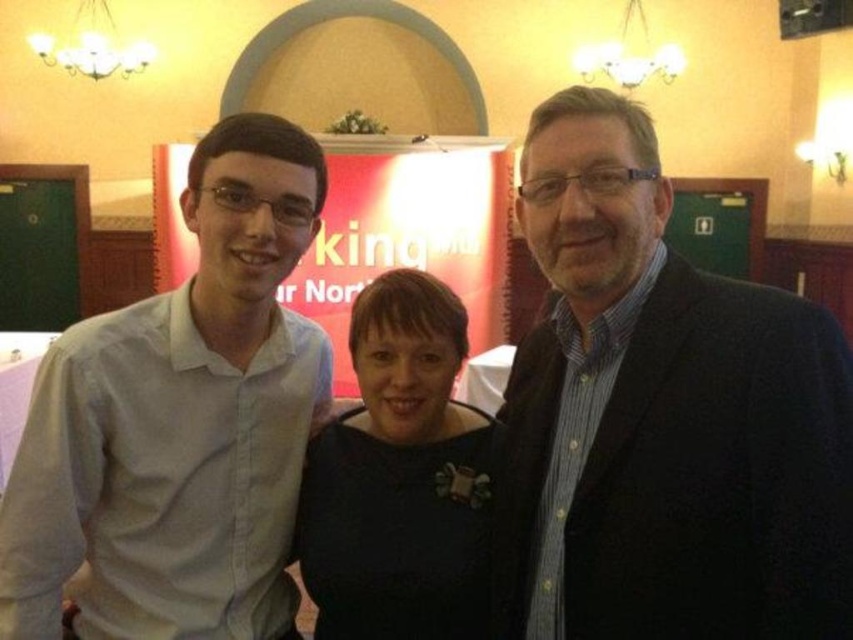
Question: Estimate the real-world distances between objects in this image. Which object is farther from the white shirt at center?

Choices:
 (A) black matte dress at center
 (B) dark blue suit at center

Answer: (B)

Question: Is white shirt at center below black matte dress at center?

Choices:
 (A) yes
 (B) no

Answer: (B)

Question: Considering the relative positions of dark blue suit at center and white shirt at center in the image provided, where is dark blue suit at center located with respect to white shirt at center?

Choices:
 (A) below
 (B) above

Answer: (B)

Question: Which of the following is the farthest from the observer?

Choices:
 (A) black matte dress at center
 (B) dark blue suit at center

Answer: (A)

Question: Is white shirt at center to the right of black matte dress at center from the viewer's perspective?

Choices:
 (A) no
 (B) yes

Answer: (A)

Question: Which of the following is the closest to the observer?

Choices:
 (A) white shirt at center
 (B) dark blue suit at center

Answer: (B)